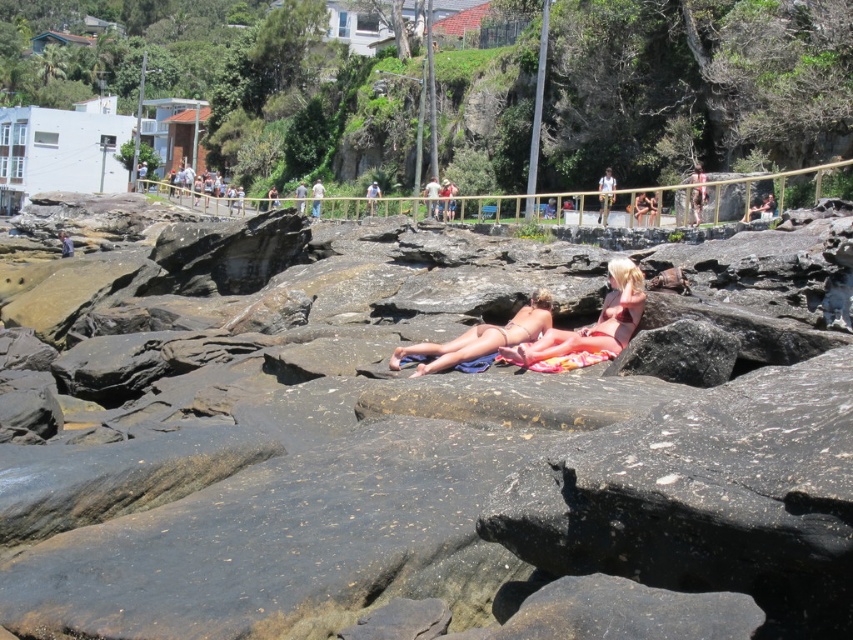
You are a photographer trying to capture a closeup shot of the smooth gray rock at center. However, you notice the bright pink bikini at center is blocking your view. Can you move the bikini to the side to get a clear shot of the rock?

The smooth gray rock at center is in front of the bright pink bikini at center, so the bikini is behind the rock and not blocking it. Therefore, you don not need to move the bikini to capture the rock.

You are a photographer trying to capture the best shot of the smooth gray rock at center and the bright pink bikini at center. Since you want to focus on the rock, which object should you position closer to the foreground to ensure the rock stands out more?

To make the smooth gray rock at center stand out more, position the bright pink bikini at center closer to the foreground. Since the smooth gray rock at center is taller than the bright pink bikini at center, placing the smaller object in the foreground can create depth and draw attention to the taller rock in the background.